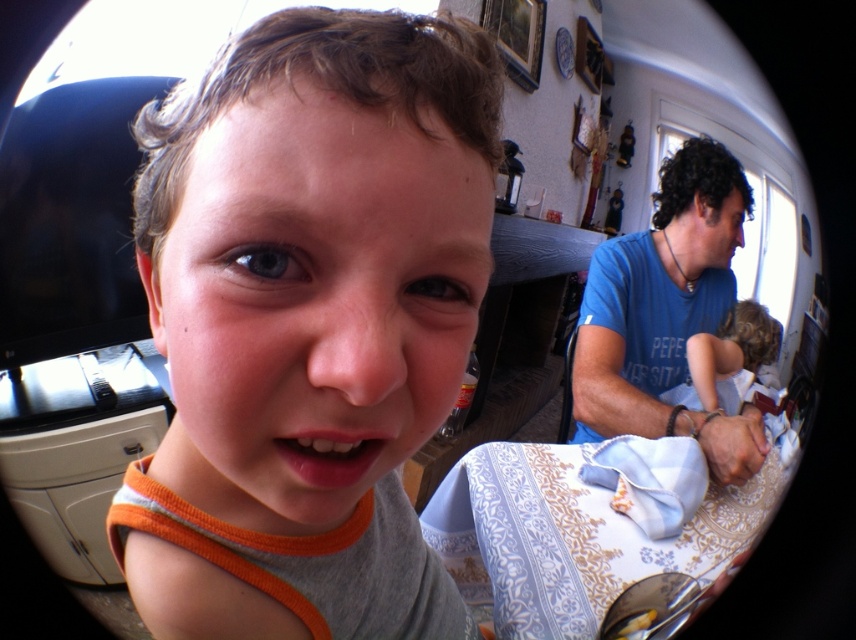
Question: Is orange fabric shirt at center positioned at the back of yellow matte bread at lower right?

Choices:
 (A) no
 (B) yes

Answer: (A)

Question: Is blue cotton shirt at right thinner than yellow matte bread at lower right?

Choices:
 (A) yes
 (B) no

Answer: (B)

Question: Is orange fabric shirt at center closer to camera compared to blonde hair at right?

Choices:
 (A) no
 (B) yes

Answer: (B)

Question: Which point appears closest to the camera in this image?

Choices:
 (A) (759, 310)
 (B) (629, 618)
 (C) (287, 102)

Answer: (C)

Question: Which of these objects is positioned closest to the blonde hair at right?

Choices:
 (A) orange fabric shirt at center
 (B) yellow matte bread at lower right

Answer: (B)

Question: Considering the real-world distances, which object is closest to the blue cotton shirt at right?

Choices:
 (A) blonde hair at right
 (B) yellow matte bread at lower right

Answer: (A)